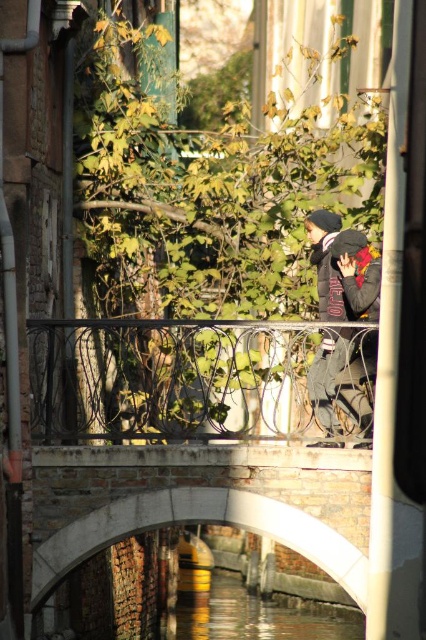
Is dark gray jacket at center wider than clear water at canal center?

Incorrect, dark gray jacket at center's width does not surpass clear water at canal center's.

Where is `dark gray jacket at center`? dark gray jacket at center is located at coordinates (342, 269).

Which is more to the right, concrete bridge at center or clear water at canal center?

clear water at canal center

Can you confirm if concrete bridge at center is wider than clear water at canal center?

In fact, concrete bridge at center might be narrower than clear water at canal center.

The width and height of the screenshot is (426, 640). What are the coordinates of `concrete bridge at center` in the screenshot? It's located at (192, 419).

Is concrete bridge at center bigger than dark gray jacket at center?

Correct, concrete bridge at center is larger in size than dark gray jacket at center.

At what (x,y) coordinates should I click in order to perform the action: click on concrete bridge at center. Please return your answer as a coordinate pair (x, y). Looking at the image, I should click on (192, 419).